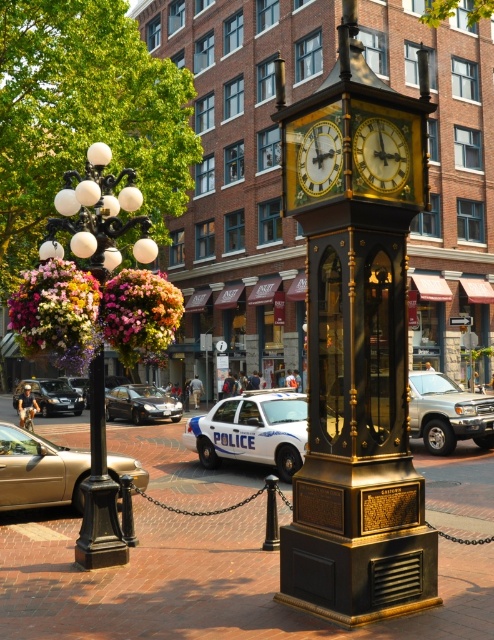
Question: Among these objects, which one is farthest from the camera?

Choices:
 (A) gold/glass clock at center
 (B) gold polished clock at center

Answer: (B)

Question: Is gold polished clock at center wider than shiny black sedan at center?

Choices:
 (A) no
 (B) yes

Answer: (A)

Question: Is shiny black sedan at center further to the viewer compared to shiny black sedan at left?

Choices:
 (A) no
 (B) yes

Answer: (A)

Question: Which object appears farthest from the camera in this image?

Choices:
 (A) shiny black sedan at center
 (B) white glossy police car at center
 (C) gold polished clock at center

Answer: (B)

Question: Among these objects, which one is nearest to the camera?

Choices:
 (A) gold metallic car at lower left
 (B) gold polished metal clock at center
 (C) brick pavement at center
 (D) white glossy police car at center

Answer: (C)

Question: Does gold/glass clock at center appear over shiny black sedan at center?

Choices:
 (A) no
 (B) yes

Answer: (B)